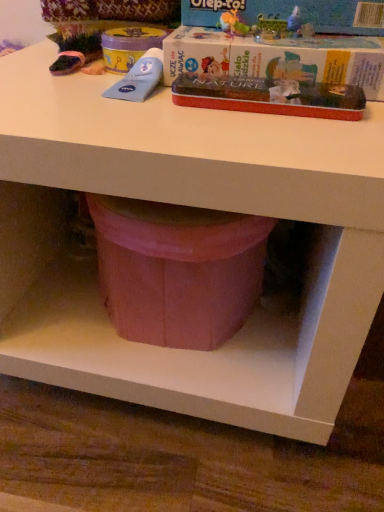
Find the location of a particular element. The width and height of the screenshot is (384, 512). vacant space positioned to the left of metallic red tin at upper center, the 1th paperback book positioned from the bottom is located at coordinates [x=122, y=115].